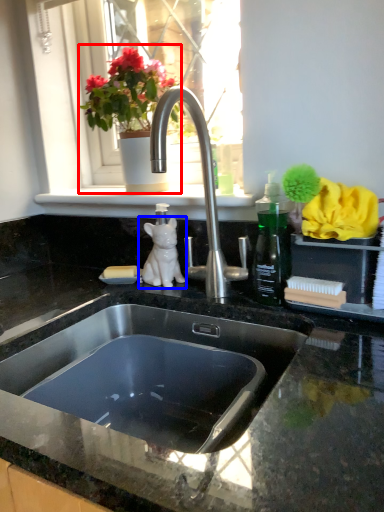
Question: Which point is further to the camera, houseplant (highlighted by a red box) or animal (highlighted by a blue box)?

Choices:
 (A) houseplant
 (B) animal

Answer: (B)